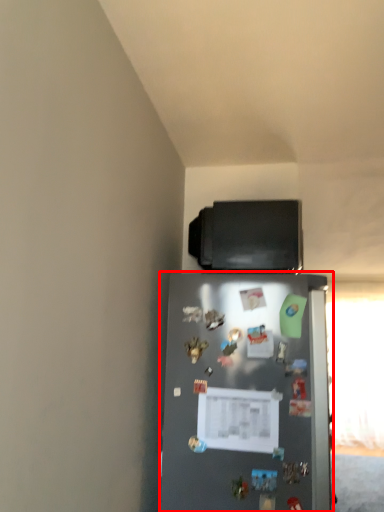
Question: From the image's perspective, where is refrigerator (annotated by the red box) located relative to appliance?

Choices:
 (A) above
 (B) below

Answer: (B)